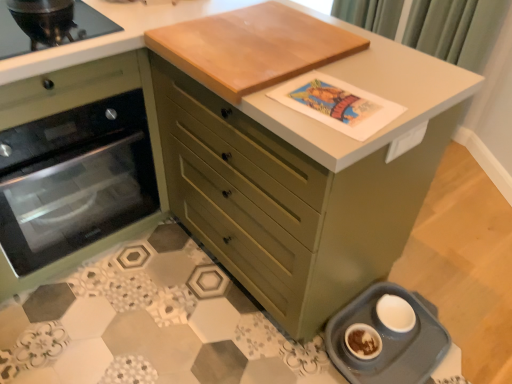
Describe the element at coordinates (455, 29) in the screenshot. The width and height of the screenshot is (512, 384). I see `green fabric curtain at upper right` at that location.

In order to face matte green chest of drawers at center, should I rotate leftwards or rightwards?

A 3.927 degree turn to the left will do.

At what (x,y) coordinates should I click in order to perform the action: click on gray plastic pet feeder at lower right. Please return your answer as a coordinate pair (x, y). This screenshot has width=512, height=384. Looking at the image, I should click on tap(388, 341).

The image size is (512, 384). What are the coordinates of `green fabric curtain at upper right` in the screenshot? It's located at (455, 29).

From a real-world perspective, is light brown wood cutting board at upper center below matte green oven at left?

No, from a real-world perspective, light brown wood cutting board at upper center is not under matte green oven at left.

Which object is thinner, light brown wood cutting board at upper center or matte green oven at left?

light brown wood cutting board at upper center.

There is a matte green oven at left. At what (x,y) coordinates should I click in order to perform the action: click on table top above it (from a real-world perspective). Please return your answer as a coordinate pair (x, y). This screenshot has width=512, height=384. Looking at the image, I should click on (251, 48).

Is light brown wood cutting board at upper center looking in the opposite direction of matte green oven at left?

No.

Can you confirm if green fabric curtain at upper right is thinner than gray plastic pet feeder at lower right?

Yes.

This screenshot has width=512, height=384. In order to click on curtain above the gray plastic pet feeder at lower right (from the image's perspective) in this screenshot , I will do `click(455, 29)`.

How different are the orientations of green fabric curtain at upper right and gray plastic pet feeder at lower right in degrees?

90.8 degrees.

The width and height of the screenshot is (512, 384). In the image, there is a matte green oven at left. Find the location of `curtain above it (from the image's perspective)`. curtain above it (from the image's perspective) is located at coordinates (455, 29).

From a real-world perspective, is matte green oven at left above or below green fabric curtain at upper right?

matte green oven at left is situated lower than green fabric curtain at upper right in the real world.

Considering the relative sizes of matte green oven at left and green fabric curtain at upper right in the image provided, is matte green oven at left thinner than green fabric curtain at upper right?

No.

Is matte green oven at left completely or partially outside of green fabric curtain at upper right?

Yes, matte green oven at left is outside of green fabric curtain at upper right.

From a real-world perspective, is matte green oven at left physically located above or below matte green chest of drawers at center?

Clearly, from a real-world perspective, matte green oven at left is below matte green chest of drawers at center.

Is matte green oven at left taller or shorter than matte green chest of drawers at center?

Considering their sizes, matte green oven at left has less height than matte green chest of drawers at center.

From the image's perspective, which one is positioned higher, matte green oven at left or matte green chest of drawers at center?

matte green chest of drawers at center.

Is matte green chest of drawers at center inside matte green oven at left?

That's incorrect, matte green chest of drawers at center is not inside matte green oven at left.

Is green fabric curtain at upper right facing away from matte green oven at left?

green fabric curtain at upper right is not turned away from matte green oven at left.

Can you confirm if green fabric curtain at upper right is smaller than matte green oven at left?

Yes, green fabric curtain at upper right is smaller than matte green oven at left.

Is point (474, 14) more distant than point (95, 146)?

Yes.

From a real-world perspective, which object rests below the other?

gray plastic pet feeder at lower right, from a real-world perspective.

Considering the points (94, 233) and (403, 362), which point is behind, point (94, 233) or point (403, 362)?

Point (94, 233)

At what (x,y) coordinates should I click in order to perform the action: click on appliance on the right of the matte green oven at left. Please return your answer as a coordinate pair (x, y). The height and width of the screenshot is (384, 512). Looking at the image, I should click on (388, 341).

Could gray plastic pet feeder at lower right be considered to be inside matte green oven at left?

Definitely not — gray plastic pet feeder at lower right is not inside matte green oven at left.

Which is less distant, (x=413, y=11) or (x=280, y=154)?

Point (x=413, y=11) is positioned farther from the camera compared to point (x=280, y=154).

Is green fabric curtain at upper right smaller than matte green chest of drawers at center?

Indeed, green fabric curtain at upper right has a smaller size compared to matte green chest of drawers at center.

Where is `chest of drawers on the left of the green fabric curtain at upper right`? chest of drawers on the left of the green fabric curtain at upper right is located at coordinates (288, 202).

From a real-world perspective, is green fabric curtain at upper right above or below matte green chest of drawers at center?

Clearly, from a real-world perspective, green fabric curtain at upper right is above matte green chest of drawers at center.

Identify the location of table top in front of the matte green oven at left. (251, 48).

Where is `appliance on the left of green fabric curtain at upper right`? The width and height of the screenshot is (512, 384). appliance on the left of green fabric curtain at upper right is located at coordinates coord(388,341).

Considering their positions, is gray plastic pet feeder at lower right positioned further to matte green oven at left than green fabric curtain at upper right?

green fabric curtain at upper right lies further to matte green oven at left than the other object.

Considering their positions, is matte green oven at left positioned further to gray plastic pet feeder at lower right than green fabric curtain at upper right?

green fabric curtain at upper right lies further to gray plastic pet feeder at lower right than the other object.

Considering their positions, is green fabric curtain at upper right positioned closer to light brown wood cutting board at upper center than gray plastic pet feeder at lower right?

gray plastic pet feeder at lower right lies closer to light brown wood cutting board at upper center than the other object.

Estimate the real-world distances between objects in this image. Which object is further from gray plastic pet feeder at lower right, green fabric curtain at upper right or light brown wood cutting board at upper center?

The object further to gray plastic pet feeder at lower right is green fabric curtain at upper right.

When comparing their distances from matte green chest of drawers at center, does gray plastic pet feeder at lower right or matte green oven at left seem closer?

gray plastic pet feeder at lower right is positioned closer to the anchor matte green chest of drawers at center.

From the image, which object appears to be farther from matte green chest of drawers at center, matte green oven at left or green fabric curtain at upper right?

green fabric curtain at upper right is further to matte green chest of drawers at center.

Looking at the image, which one is located closer to green fabric curtain at upper right, gray plastic pet feeder at lower right or matte green oven at left?

gray plastic pet feeder at lower right.

Based on their spatial positions, is light brown wood cutting board at upper center or matte green chest of drawers at center further from gray plastic pet feeder at lower right?

Among the two, light brown wood cutting board at upper center is located further to gray plastic pet feeder at lower right.

I want to click on the chest of drawers situated between matte green oven at left and light brown wood cutting board at upper center from left to right, so click(x=288, y=202).

Identify the location of table top between green fabric curtain at upper right and gray plastic pet feeder at lower right in the vertical direction. (251, 48).

In order to click on appliance between matte green oven at left and green fabric curtain at upper right from left to right in this screenshot , I will do `click(388, 341)`.

At what (x,y) coordinates should I click in order to perform the action: click on the chest of drawers that lies between light brown wood cutting board at upper center and gray plastic pet feeder at lower right from top to bottom. Please return your answer as a coordinate pair (x, y). Looking at the image, I should click on (288, 202).